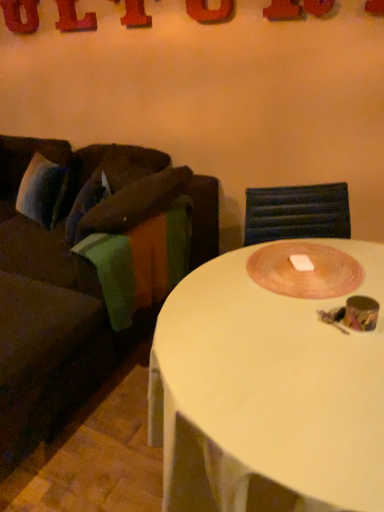
Locate an element on the screen. The width and height of the screenshot is (384, 512). free space to the left of wooden placemat at center is located at coordinates (214, 291).